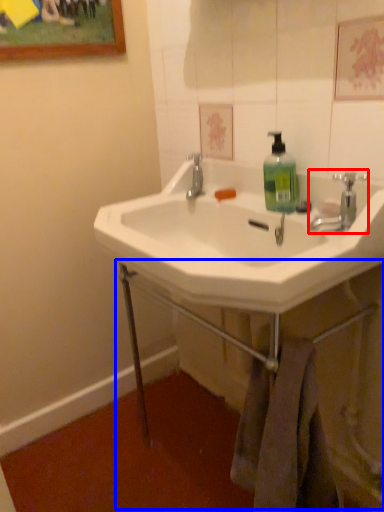
Question: Which object appears farthest to the camera in this image, tap (highlighted by a red box) or counter (highlighted by a blue box)?

Choices:
 (A) tap
 (B) counter

Answer: (A)